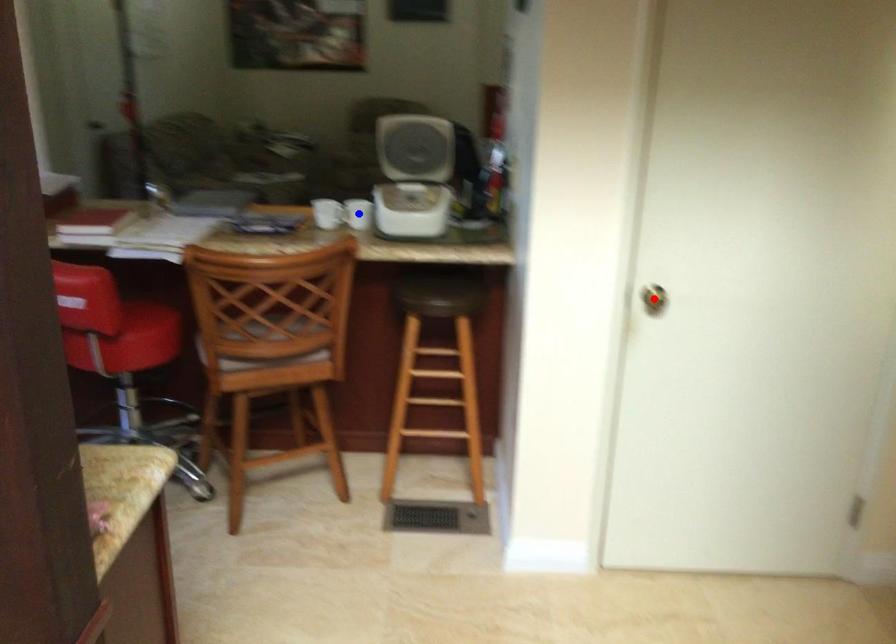
Question: In the image, two points are highlighted. Which point is nearer to the camera? Reply with the corresponding letter.

Choices:
 (A) blue point
 (B) red point

Answer: (B)